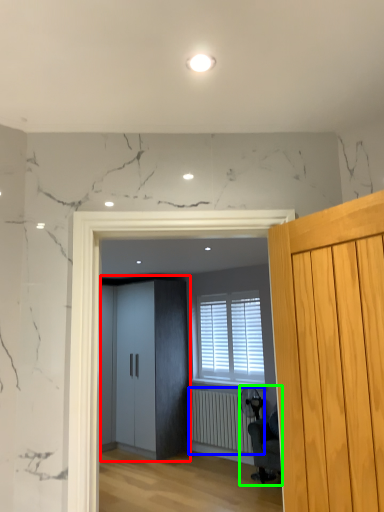
Question: Which is nearer to the elevator (highlighted by a red box)? radiator (highlighted by a blue box) or swivel chair (highlighted by a green box).

Choices:
 (A) radiator
 (B) swivel chair

Answer: (A)